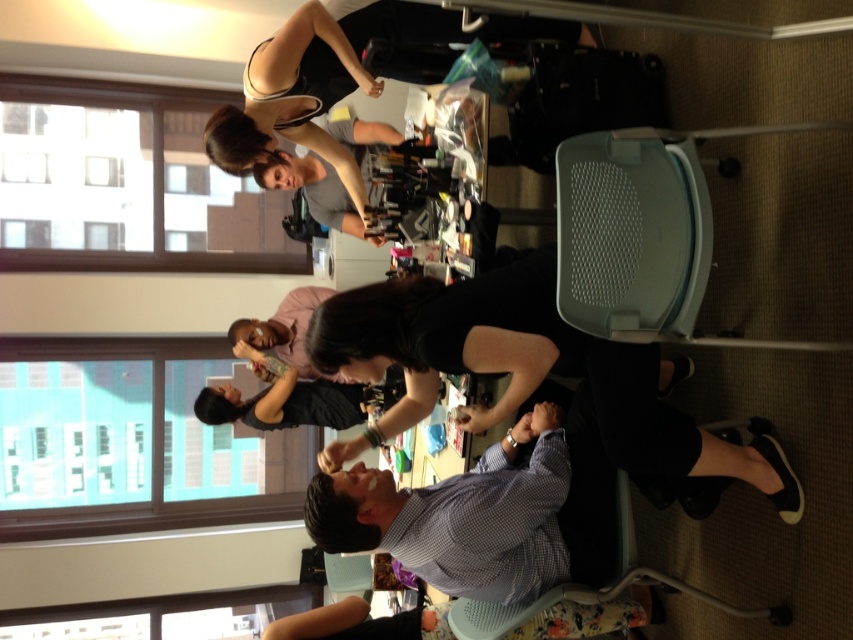
You are a photographer setting up for a photoshoot and need to position a light to the left of both the checkered fabric shirt at center and the black matte tank top at upper center. Based on their positions, which object should the light be placed to the left of to achieve this?

The checkered fabric shirt at center is to the right of the black matte tank top at upper center, so placing the light to the left of the checkered fabric shirt at center would also be to the left of the black matte tank top at upper center.

You are a makeup artist who needs to place a new makeup palette between the checkered fabric shirt at center and the black matte tank top at upper center. The palette is 1.2 feet wide. Can you fit it in the space between them?

The distance between the checkered fabric shirt at center and the black matte tank top at upper center is 3.97 feet. Since the palette is only 1.2 feet wide, there is sufficient space to place it between them.